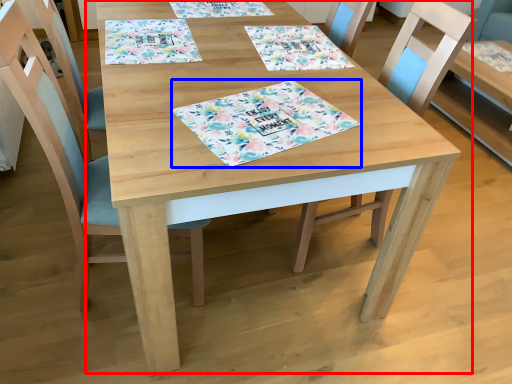
Question: Which point is further to the camera, table (highlighted by a red box) or place mat (highlighted by a blue box)?

Choices:
 (A) table
 (B) place mat

Answer: (B)